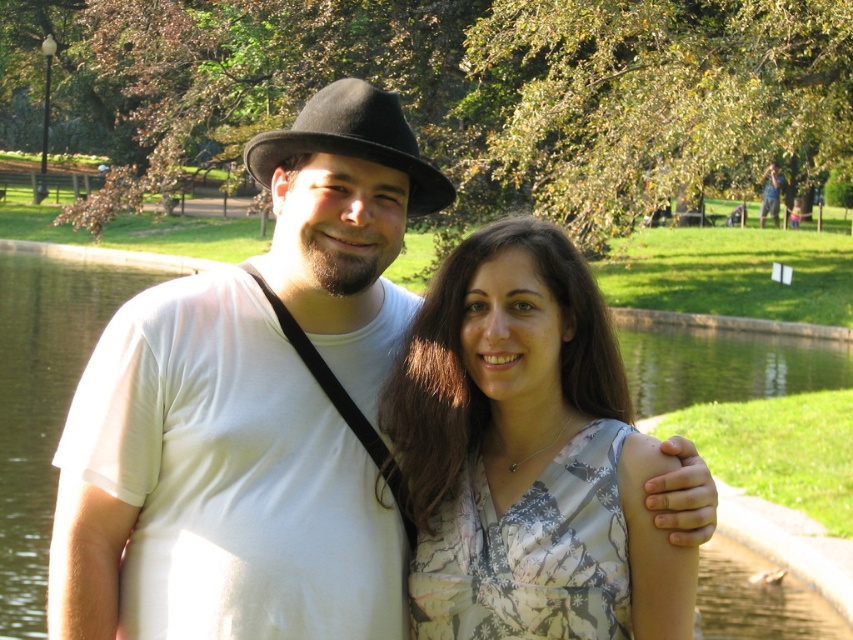
You are a photographer standing at the edge of the park. You want to take a photo of both the white matte shirt at center and the floral print blouse at center so that they appear in focus simultaneously. Considering the depth of field, which is 20 inches, can you capture both subjects clearly in the same shot?

The white matte shirt at center is 24.45 inches away from the floral print blouse at center. Since the depth of field is 20 inches, which is shorter than the distance between them, you cannot capture both in focus at the same time.

Consider the image. Based on the scene description, which object is taller between the white matte shirt at center and the black felt fedora at center?

The white matte shirt at center is taller than the black felt fedora at center according to the description.

You are a photographer trying to capture a photo of the two people in the park. You want to ensure that both the floral print blouse at center and the black felt fedora at center are clearly visible in the frame. Based on their positions, which item is closer to the camera?

The floral print blouse at center is positioned under the black felt fedora at center, so the black felt fedora at center is closer to the camera since it is above the blouse.